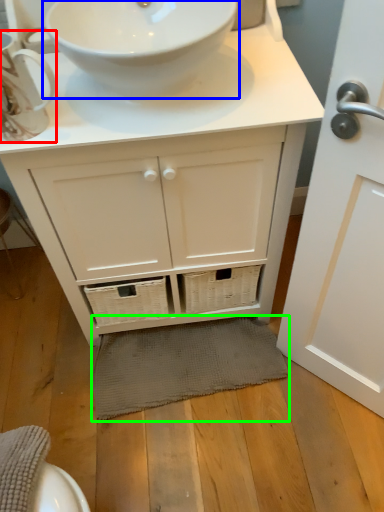
Question: Estimate the real-world distances between objects in this image. Which object is farther from teacup (highlighted by a red box), sink (highlighted by a blue box) or bath mat (highlighted by a green box)?

Choices:
 (A) sink
 (B) bath mat

Answer: (B)